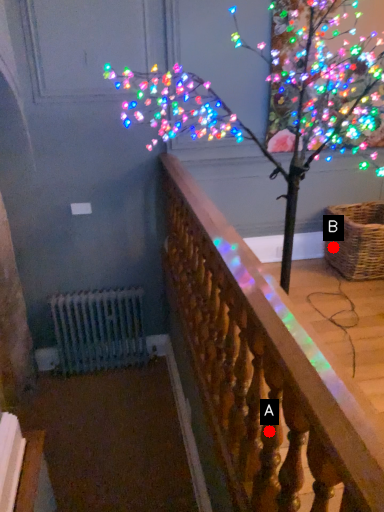
Question: Two points are circled on the image, labeled by A and B beside each circle. Which point is closer to the camera?

Choices:
 (A) A is closer
 (B) B is closer

Answer: (A)